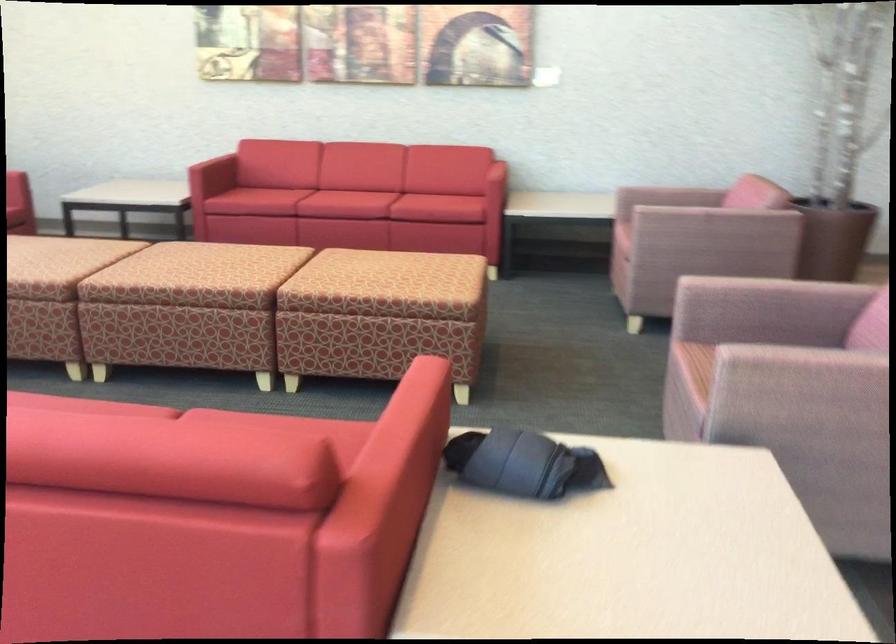
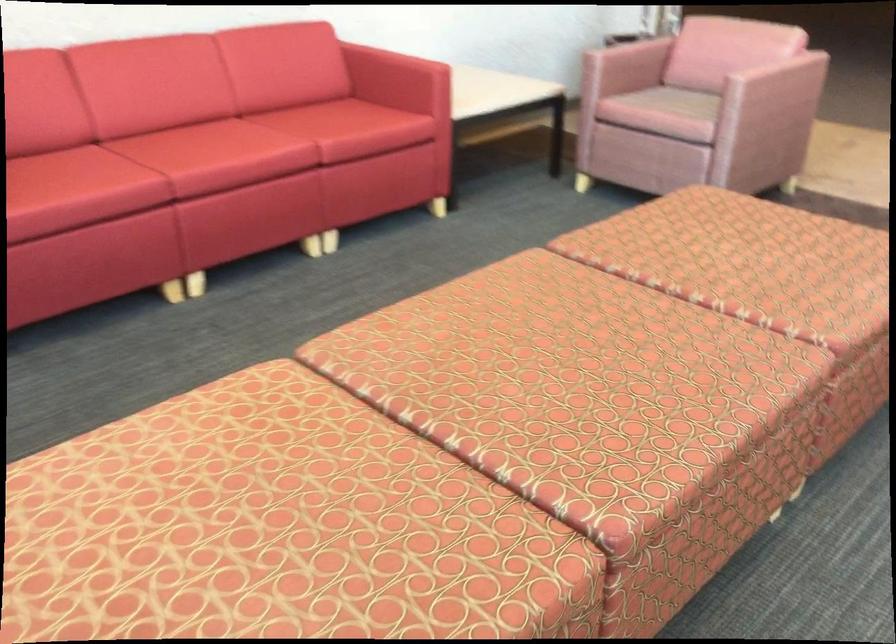
Find the pixel in the second image that matches [339,176] in the first image.

(196, 144)